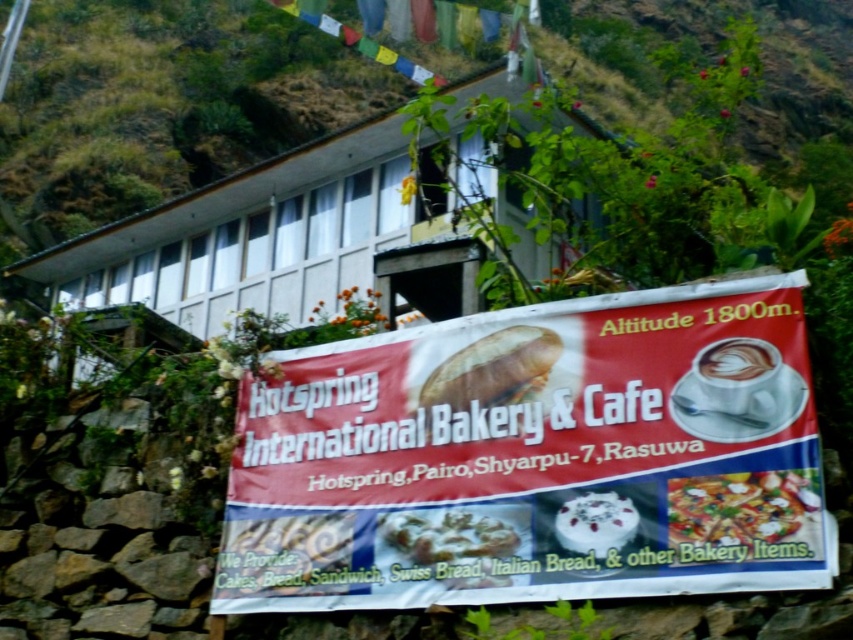
You are standing in front of the Hotspring International Bakery signboard. There are two points marked on the signboard at coordinates point (x=341, y=412) and point (x=747, y=394). Which point is closer to you?

Point (x=341, y=412) is further to the camera than point (x=747, y=394), so the point closer to you is point (x=747, y=394).

You are standing in front of the Hotspring International Bakery signboard. There is a point marked at coordinates (741, 515). What is located at that point on the signboard?

The point at coordinates (741, 515) marks the cheesy pizza at center.